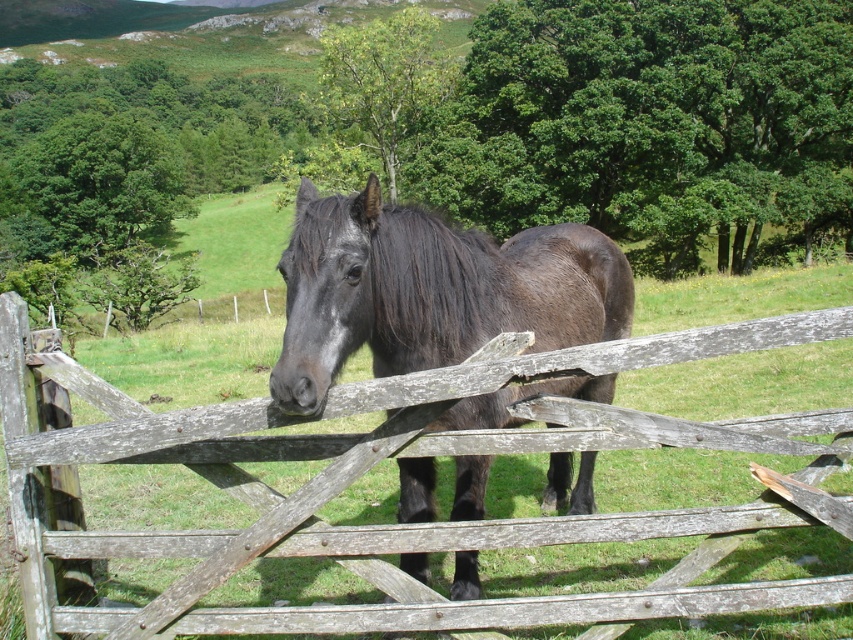
Who is taller, weathered wood fence at center or shiny black horse at center?

weathered wood fence at center

Can you confirm if weathered wood fence at center is shorter than shiny black horse at center?

Incorrect, weathered wood fence at center's height does not fall short of shiny black horse at center's.

Is point (328, 529) positioned before point (434, 244)?

Yes.

At what (x,y) coordinates should I click in order to perform the action: click on weathered wood fence at center. Please return your answer as a coordinate pair (x, y). The image size is (853, 640). Looking at the image, I should click on (399, 458).